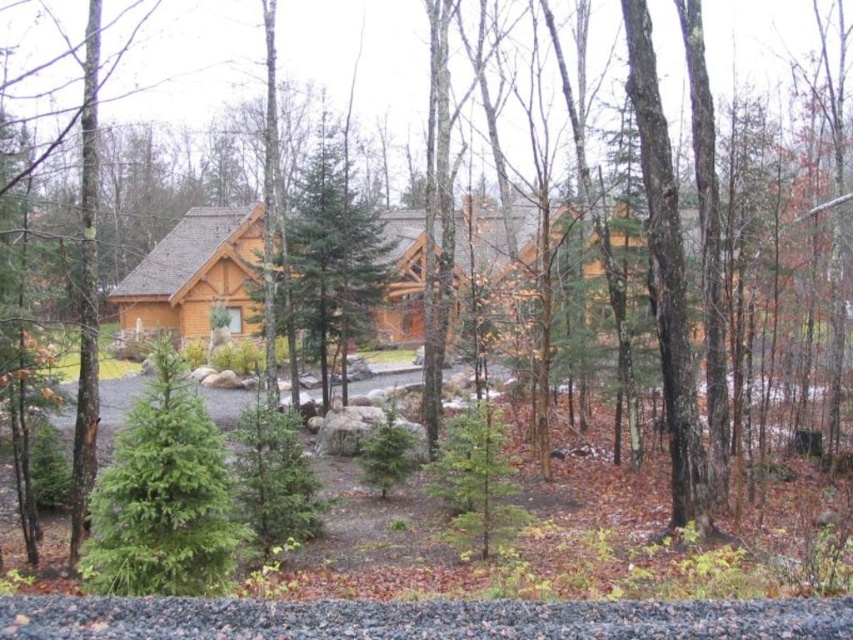
In the scene shown: How much distance is there between wooden cabin at center and green textured evergreen tree at center?

wooden cabin at center is 11.14 feet away from green textured evergreen tree at center.

Between wooden cabin at center and green textured evergreen tree at center, which one is positioned higher?

wooden cabin at center is higher up.

Identify the location of wooden cabin at center. click(x=196, y=275).

You are a GUI agent. You are given a task and a screenshot of the screen. Output one action in this format:
    pyautogui.click(x=<x>, y=<y>)
    Task: Click on the wooden cabin at center
    The width and height of the screenshot is (853, 640).
    Given the screenshot: What is the action you would take?
    pyautogui.click(x=196, y=275)

Who is positioned more to the right, green evergreen tree at center or green textured evergreen tree at center?

From the viewer's perspective, green evergreen tree at center appears more on the right side.

Is green evergreen tree at center closer to the viewer compared to green textured evergreen tree at center?

Yes, green evergreen tree at center is in front of green textured evergreen tree at center.

The height and width of the screenshot is (640, 853). What do you see at coordinates (163, 497) in the screenshot?
I see `green evergreen tree at center` at bounding box center [163, 497].

Where is `green evergreen tree at center`? green evergreen tree at center is located at coordinates (163, 497).

Who is more forward, [149,308] or [100,492]?

Point [100,492] is more forward.

Which is above, wooden cabin at center or green evergreen tree at center?

wooden cabin at center

Does point (194, 284) lie in front of point (213, 426)?

No.

At what (x,y) coordinates should I click in order to perform the action: click on wooden cabin at center. Please return your answer as a coordinate pair (x, y). Looking at the image, I should click on (196, 275).